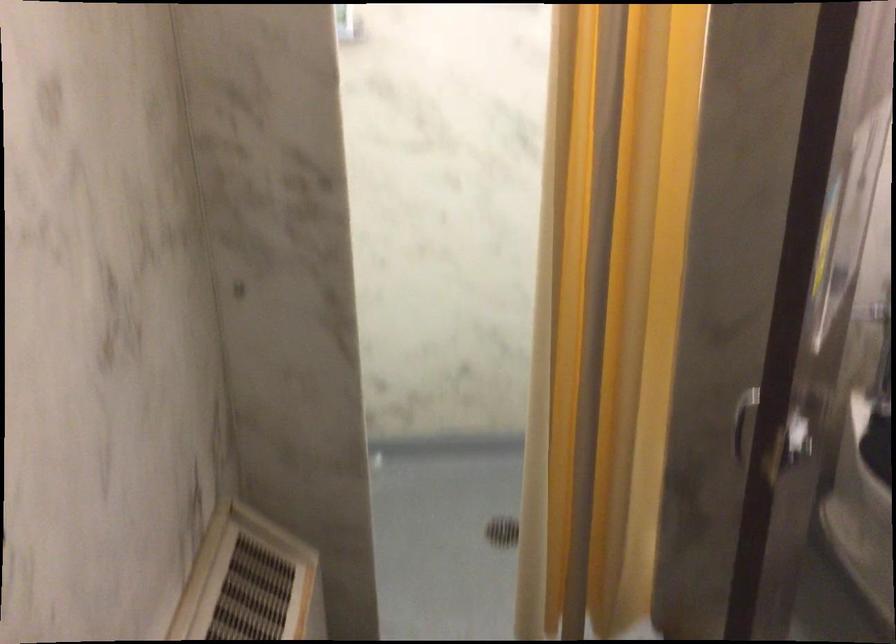
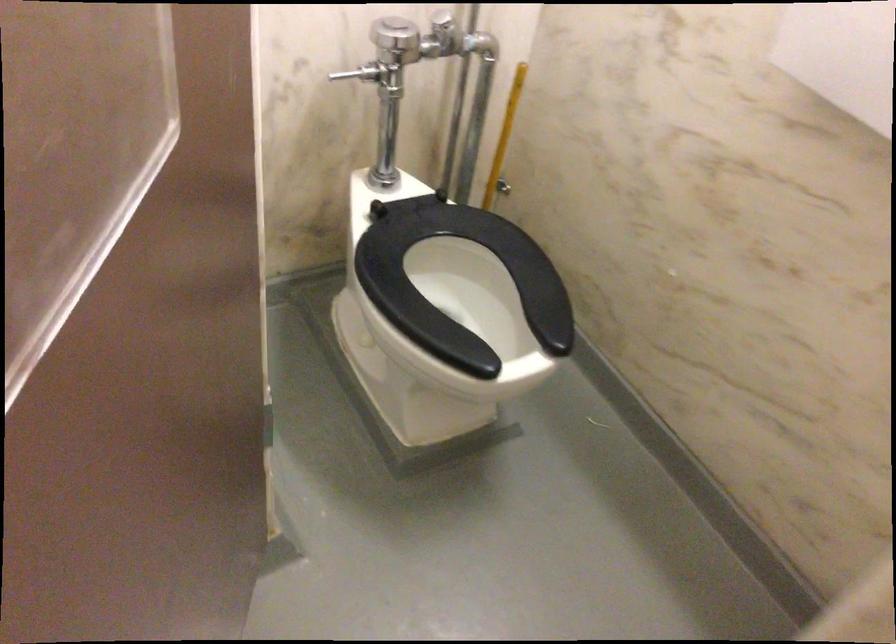
Based on the continuous images, in which direction is the camera rotating?

The camera's rotation is toward right-down.